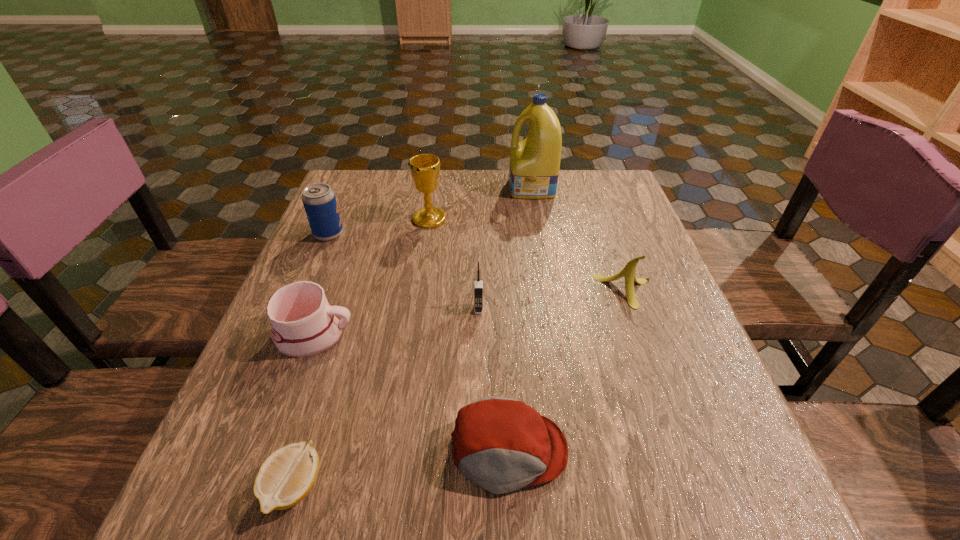
The height and width of the screenshot is (540, 960). Identify the location of vacant area that satisfies the following two spatial constraints: 1. on the front side of the banana; 2. on the left side of the beer can. pyautogui.click(x=304, y=291).